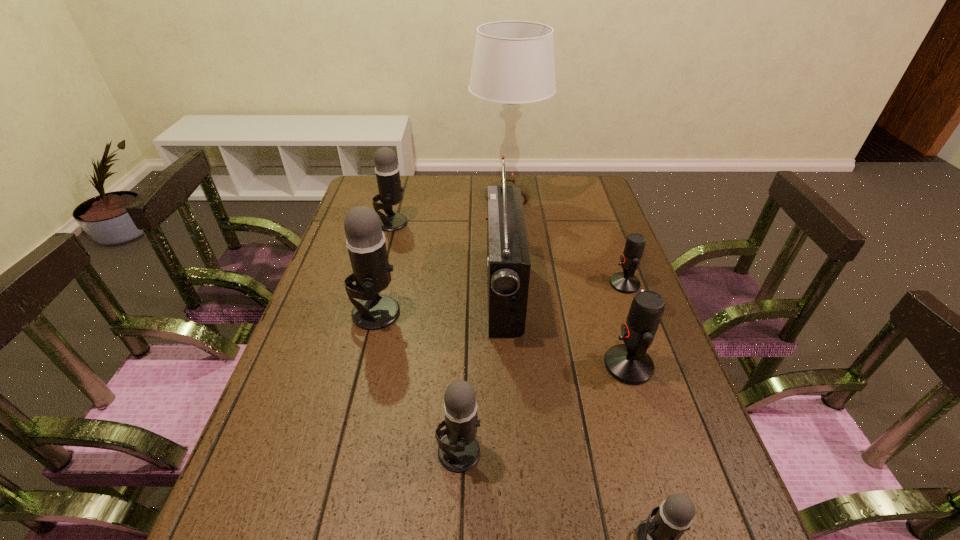
Point out which gray microphone is positioned as the second nearest to the third nearest object. Please provide its 2D coordinates. Your answer should be formatted as a tuple, i.e. [(x, y)], where the tuple contains the x and y coordinates of a point satisfying the conditions above.

[(459, 451)]

Identify which gray microphone is located as the fourth nearest to the tallest object. Please provide its 2D coordinates. Your answer should be formatted as a tuple, i.e. [(x, y)], where the tuple contains the x and y coordinates of a point satisfying the conditions above.

[(657, 539)]